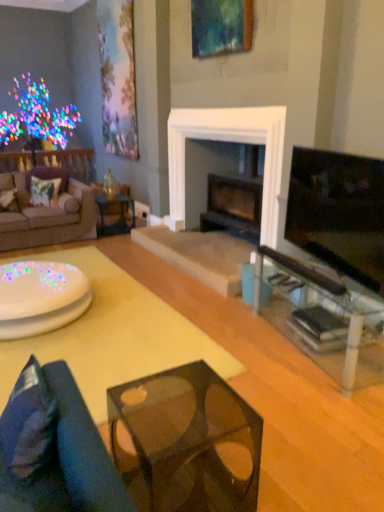
The width and height of the screenshot is (384, 512). Describe the element at coordinates (44, 192) in the screenshot. I see `floral fabric pillow at left, which is the second pillow from left to right` at that location.

What are the coordinates of `brown fabric couch at left, the 2th studio couch when ordered from bottom to top` in the screenshot? It's located at (48, 217).

The image size is (384, 512). What do you see at coordinates (118, 77) in the screenshot?
I see `matte floral painting at upper left, positioned as the first picture frame in back-to-front order` at bounding box center [118, 77].

What do you see at coordinates (115, 215) in the screenshot? The width and height of the screenshot is (384, 512). I see `metallic glass side table at center` at bounding box center [115, 215].

Where is `dark blue fabric pillow at lower left, positioned as the third pillow in top-to-bottom order`? dark blue fabric pillow at lower left, positioned as the third pillow in top-to-bottom order is located at coordinates (28, 424).

Find the location of a particular element. wooden picture frame at upper center, the 1th picture frame positioned from the front is located at coordinates (221, 27).

Between matte floral painting at upper left, positioned as the first picture frame in back-to-front order, and transparent glass table at right, marked as the 3th table in a left-to-right arrangement, which one has larger size?

transparent glass table at right, marked as the 3th table in a left-to-right arrangement, is bigger.

Is matte floral painting at upper left, positioned as the 2th picture frame in right-to-left order, to the left of transparent glass table at right, placed as the 1th table when sorted from right to left, from the viewer's perspective?

Correct, you'll find matte floral painting at upper left, positioned as the 2th picture frame in right-to-left order, to the left of transparent glass table at right, placed as the 1th table when sorted from right to left.

How distant is matte floral painting at upper left, positioned as the 2th picture frame in right-to-left order, from transparent glass table at right, placed as the 1th table when sorted from right to left?

matte floral painting at upper left, positioned as the 2th picture frame in right-to-left order, and transparent glass table at right, placed as the 1th table when sorted from right to left, are 3.67 meters apart.

Which table is the 2nd one when counting from the right side of the matte floral painting at upper left, positioned as the 2th picture frame in right-to-left order? Please provide its 2D coordinates.

[(321, 320)]

Does dark blue fabric pillow at lower left, which is the first pillow from bottom to top, turn towards brown fabric couch at left, which ranks as the 1th studio couch in left-to-right order?

No, dark blue fabric pillow at lower left, which is the first pillow from bottom to top, does not turn towards brown fabric couch at left, which ranks as the 1th studio couch in left-to-right order.

In terms of width, does dark blue fabric pillow at lower left, positioned as the 3th pillow in left-to-right order, look wider or thinner when compared to brown fabric couch at left, the 2th studio couch when ordered from bottom to top?

In the image, dark blue fabric pillow at lower left, positioned as the 3th pillow in left-to-right order, appears to be more narrow than brown fabric couch at left, the 2th studio couch when ordered from bottom to top.

From the image's perspective, who appears lower, dark blue fabric pillow at lower left, positioned as the first pillow in front-to-back order, or brown fabric couch at left, positioned as the 1th studio couch in top-to-bottom order?

dark blue fabric pillow at lower left, positioned as the first pillow in front-to-back order, is shown below in the image.

The width and height of the screenshot is (384, 512). Find the location of `fireplace above the translucent glass cube at center, the second table in the right-to-left sequence (from a real-world perspective)`. fireplace above the translucent glass cube at center, the second table in the right-to-left sequence (from a real-world perspective) is located at coordinates (x=228, y=141).

From a real-world perspective, is translucent glass cube at center, the second table in the right-to-left sequence, beneath black stone fireplace at center?

Correct, in the physical world, translucent glass cube at center, the second table in the right-to-left sequence, is lower than black stone fireplace at center.

What's the angular difference between translucent glass cube at center, arranged as the 2th table when viewed from the left, and black stone fireplace at center's facing directions?

95 degrees.

Between translucent glass cube at center, arranged as the 2th table when viewed from the left, and black stone fireplace at center, which one appears on the left side from the viewer's perspective?

translucent glass cube at center, arranged as the 2th table when viewed from the left, is more to the left.

Where is `the 1st picture frame located above the translucent glass coffee table at lower center (from a real-world perspective)`? This screenshot has width=384, height=512. the 1st picture frame located above the translucent glass coffee table at lower center (from a real-world perspective) is located at coordinates (118, 77).

Is point (115, 8) closer to camera compared to point (161, 366)?

No, it is behind (161, 366).

Could you tell me if matte floral painting at upper left, which is the second picture frame in front-to-back order, is turned towards translucent glass coffee table at lower center?

No, matte floral painting at upper left, which is the second picture frame in front-to-back order, does not turn towards translucent glass coffee table at lower center.

How distant is matte floral painting at upper left, acting as the 1th picture frame starting from the left, from translucent glass coffee table at lower center?

matte floral painting at upper left, acting as the 1th picture frame starting from the left, and translucent glass coffee table at lower center are 3.19 meters apart.

Is metallic glass side table at center not close to dark blue fabric pillow at lower left, positioned as the third pillow in top-to-bottom order?

metallic glass side table at center is positioned a significant distance from dark blue fabric pillow at lower left, positioned as the third pillow in top-to-bottom order.

Would you say metallic glass side table at center is inside or outside dark blue fabric pillow at lower left, which is counted as the first pillow, starting from the right?

metallic glass side table at center lies outside dark blue fabric pillow at lower left, which is counted as the first pillow, starting from the right.

Considering the sizes of metallic glass side table at center and dark blue fabric pillow at lower left, which is counted as the first pillow, starting from the right, in the image, is metallic glass side table at center taller or shorter than dark blue fabric pillow at lower left, which is counted as the first pillow, starting from the right,?

Considering their sizes, metallic glass side table at center has more height than dark blue fabric pillow at lower left, which is counted as the first pillow, starting from the right.

Is point (130, 202) closer to viewer compared to point (32, 469)?

No, (130, 202) is behind (32, 469).

Which is further, [341,297] or [123,475]?

Point [341,297]

Which is correct: transparent glass table at right, marked as the 3th table in a left-to-right arrangement, is inside translucent glass cube at center, the second table in the right-to-left sequence, or outside of it?

transparent glass table at right, marked as the 3th table in a left-to-right arrangement, is not inside translucent glass cube at center, the second table in the right-to-left sequence, it's outside.

From the image's perspective, which one is positioned higher, transparent glass table at right, placed as the 1th table when sorted from right to left, or translucent glass cube at center, the second table in the right-to-left sequence?

From the image's view, transparent glass table at right, placed as the 1th table when sorted from right to left, is above.

Considering the positions of objects transparent glass table at right, marked as the 3th table in a left-to-right arrangement, and translucent glass cube at center, arranged as the 2th table when viewed from the left, in the image provided, who is behind, transparent glass table at right, marked as the 3th table in a left-to-right arrangement, or translucent glass cube at center, arranged as the 2th table when viewed from the left,?

transparent glass table at right, marked as the 3th table in a left-to-right arrangement, is behind.

Does transparent glass table at right, placed as the 1th table when sorted from right to left, have a lesser width compared to velvet green pillow at left, which ranks as the 2th pillow in back-to-front order?

No, transparent glass table at right, placed as the 1th table when sorted from right to left, is not thinner than velvet green pillow at left, which ranks as the 2th pillow in back-to-front order.

Is transparent glass table at right, marked as the 3th table in a left-to-right arrangement, in front of or behind velvet green pillow at left, the second pillow in the top-to-bottom sequence, in the image?

Clearly, transparent glass table at right, marked as the 3th table in a left-to-right arrangement, is in front of velvet green pillow at left, the second pillow in the top-to-bottom sequence.

Is point (330, 367) closer or farther from the camera than point (2, 211)?

Point (330, 367) is positioned closer to the camera compared to point (2, 211).

From a real-world perspective, is transparent glass table at right, placed as the 1th table when sorted from right to left, above or below velvet green pillow at left, marked as the second pillow in a front-to-back arrangement?

In terms of real-world spatial position, transparent glass table at right, placed as the 1th table when sorted from right to left, is below velvet green pillow at left, marked as the second pillow in a front-to-back arrangement.

From the matte floral painting at upper left, which is the second picture frame in front-to-back order, count 2nd table to the right and point to it. Please provide its 2D coordinates.

[(321, 320)]

Where is `studio couch that appears above the dark blue fabric pillow at lower left, the 3th pillow from the back (from the image's perspective)`? This screenshot has height=512, width=384. studio couch that appears above the dark blue fabric pillow at lower left, the 3th pillow from the back (from the image's perspective) is located at coordinates (48, 217).

From the image, which object appears to be nearer to translucent glass cube at center, the second table in the right-to-left sequence, translucent glass coffee table at lower center or dark blue fabric pillow at lower left, the 3th pillow from the back?

dark blue fabric pillow at lower left, the 3th pillow from the back, is positioned closer to the anchor translucent glass cube at center, the second table in the right-to-left sequence.

From the image, which object appears to be farther from matte floral painting at upper left, positioned as the 2th picture frame in right-to-left order, black stone fireplace at center or translucent glass coffee table at lower center?

translucent glass coffee table at lower center is positioned further to the anchor matte floral painting at upper left, positioned as the 2th picture frame in right-to-left order.

Based on their spatial positions, is floral fabric pillow at left, which is the second pillow from left to right, or velvet green pillow at left, marked as the second pillow in a front-to-back arrangement, closer to matte floral painting at upper left, acting as the 1th picture frame starting from the left?

floral fabric pillow at left, which is the second pillow from left to right, lies closer to matte floral painting at upper left, acting as the 1th picture frame starting from the left, than the other object.

Considering their positions, is floral fabric pillow at left, which is the second pillow from left to right, positioned further to white glossy table at lower left, which is counted as the first table, starting from the left, than metallic glass side table at center?

metallic glass side table at center is further to white glossy table at lower left, which is counted as the first table, starting from the left.

Estimate the real-world distances between objects in this image. Which object is closer to translucent glass coffee table at lower center, translucent glass cube at center, the second table in the right-to-left sequence, or black stone fireplace at center?

translucent glass cube at center, the second table in the right-to-left sequence, is closer to translucent glass coffee table at lower center.

From the image, which object appears to be nearer to transparent glass table at right, placed as the 1th table when sorted from right to left, wooden picture frame at upper center, which ranks as the second picture frame in back-to-front order, or translucent glass coffee table at lower center?

translucent glass coffee table at lower center is positioned closer to the anchor transparent glass table at right, placed as the 1th table when sorted from right to left.

Based on their spatial positions, is matte black tv at right or translucent glass coffee table at lower center further from translucent glass cube at center, the second table in the right-to-left sequence?

matte black tv at right is further to translucent glass cube at center, the second table in the right-to-left sequence.

Based on their spatial positions, is matte floral painting at upper left, acting as the 1th picture frame starting from the left, or translucent glass cube at center, arranged as the 2th table when viewed from the left, closer to black stone fireplace at center?

matte floral painting at upper left, acting as the 1th picture frame starting from the left.

This screenshot has width=384, height=512. Identify the location of table between translucent glass coffee table at lower center and transparent glass table at right, placed as the 1th table when sorted from right to left, in the horizontal direction. (186, 442).

This screenshot has height=512, width=384. I want to click on coffee table between dark blue fabric pillow at lower left, positioned as the first pillow in front-to-back order, and velvet green pillow at left, the second pillow in the top-to-bottom sequence, from front to back, so click(x=113, y=335).

I want to click on fireplace between translucent glass cube at center, arranged as the 2th table when viewed from the left, and metallic glass side table at center from front to back, so click(x=228, y=141).

Image resolution: width=384 pixels, height=512 pixels. I want to click on fireplace between blue fabric studio couch at lower left, which is counted as the second studio couch, starting from the top, and matte floral painting at upper left, acting as the 1th picture frame starting from the left, along the z-axis, so click(x=228, y=141).